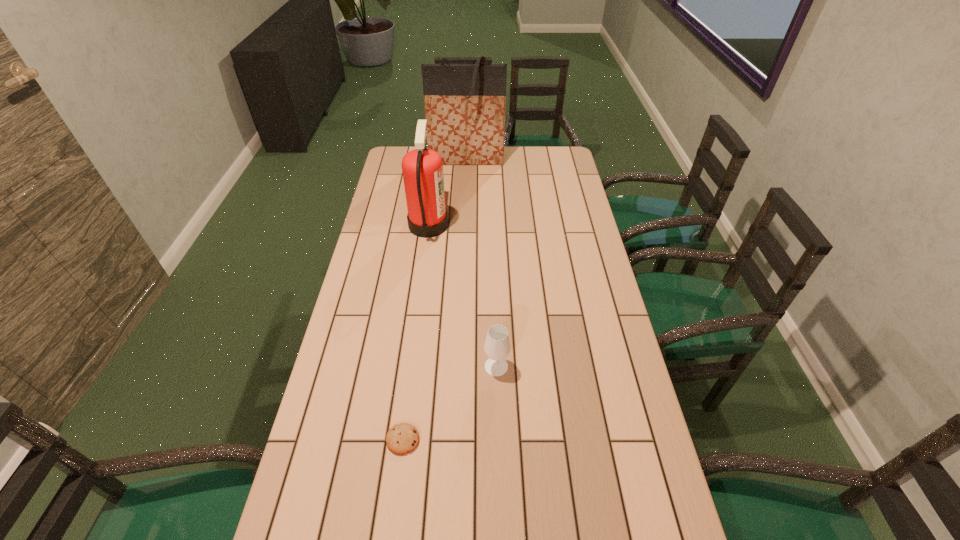
This screenshot has height=540, width=960. Identify the location of empty space between the second tallest object and the cookie. (416, 332).

What are the coordinates of `vacant region between the glass and the tallest object` in the screenshot? It's located at (481, 262).

Identify the location of free space that is in between the third farthest object and the nearest object. (449, 403).

The height and width of the screenshot is (540, 960). In order to click on object identified as the third closest to the cookie in this screenshot , I will do `click(465, 104)`.

Choose which object is the nearest neighbor to the cookie. Please provide its 2D coordinates. Your answer should be formatted as a tuple, i.e. [(x, y)], where the tuple contains the x and y coordinates of a point satisfying the conditions above.

[(497, 345)]

Where is `vacant space that satisfies the following two spatial constraints: 1. on the front-facing side of the third farthest object; 2. on the right side of the tallest object`? Image resolution: width=960 pixels, height=540 pixels. vacant space that satisfies the following two spatial constraints: 1. on the front-facing side of the third farthest object; 2. on the right side of the tallest object is located at coordinates (458, 367).

Identify the location of free spot that satisfies the following two spatial constraints: 1. on the back side of the glass; 2. at the nozzle of the second farthest object. (492, 225).

The image size is (960, 540). Find the location of `vacant area in the image that satisfies the following two spatial constraints: 1. on the back side of the shortest object; 2. at the nozzle of the fire extinguisher`. vacant area in the image that satisfies the following two spatial constraints: 1. on the back side of the shortest object; 2. at the nozzle of the fire extinguisher is located at coordinates (430, 225).